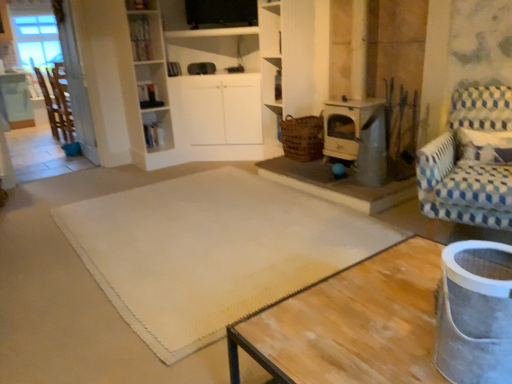
Question: Is brushed metal table at left at the back of metallic stove at center-right?

Choices:
 (A) no
 (B) yes

Answer: (A)

Question: From the image's perspective, is metallic stove at center-right over brushed metal table at left?

Choices:
 (A) yes
 (B) no

Answer: (B)

Question: Is metallic stove at center-right oriented towards brushed metal table at left?

Choices:
 (A) yes
 (B) no

Answer: (B)

Question: Is metallic stove at center-right positioned beyond the bounds of brushed metal table at left?

Choices:
 (A) yes
 (B) no

Answer: (A)

Question: Can you confirm if metallic stove at center-right is smaller than brushed metal table at left?

Choices:
 (A) yes
 (B) no

Answer: (A)

Question: From the image's perspective, is metallic stove at center-right above or below white textured mat at center?

Choices:
 (A) below
 (B) above

Answer: (B)

Question: Is point (386, 147) closer or farther from the camera than point (162, 302)?

Choices:
 (A) closer
 (B) farther

Answer: (B)

Question: From their relative heights in the image, would you say metallic stove at center-right is taller or shorter than white textured mat at center?

Choices:
 (A) tall
 (B) short

Answer: (A)

Question: From a real-world perspective, is metallic stove at center-right physically located above or below white textured mat at center?

Choices:
 (A) below
 (B) above

Answer: (B)

Question: Considering the positions of point (38, 76) and point (338, 127), is point (38, 76) closer or farther from the camera than point (338, 127)?

Choices:
 (A) farther
 (B) closer

Answer: (A)

Question: Considering the positions of wooden chair at left, which appears as the 2th chair when ordered from the bottom, and metallic stove at center-right in the image, is wooden chair at left, which appears as the 2th chair when ordered from the bottom, wider or thinner than metallic stove at center-right?

Choices:
 (A) wide
 (B) thin

Answer: (A)

Question: Relative to metallic stove at center-right, is wooden chair at left, which is the second chair in front-to-back order, in front or behind?

Choices:
 (A) front
 (B) behind

Answer: (B)

Question: From a real-world perspective, relative to metallic stove at center-right, is wooden chair at left, which is counted as the first chair, starting from the left, vertically above or below?

Choices:
 (A) below
 (B) above

Answer: (B)

Question: From the image's perspective, is white glossy bookshelf at upper center above or below white textured mat at center?

Choices:
 (A) below
 (B) above

Answer: (B)

Question: Is point (130, 6) positioned closer to the camera than point (139, 292)?

Choices:
 (A) farther
 (B) closer

Answer: (A)